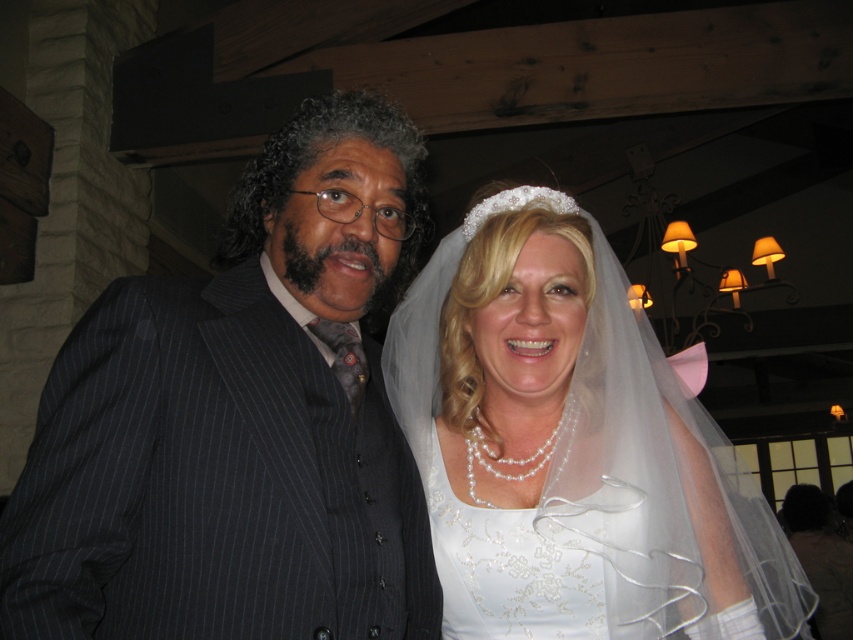
Question: Can you confirm if dark pinstripe suit at left is positioned above white satin dress at center?

Choices:
 (A) yes
 (B) no

Answer: (A)

Question: Which point appears farthest from the camera in this image?

Choices:
 (A) (733, 563)
 (B) (254, 547)

Answer: (A)

Question: Does dark pinstripe suit at left lie in front of white satin dress at center?

Choices:
 (A) no
 (B) yes

Answer: (B)

Question: Is dark pinstripe suit at left positioned before white satin dress at center?

Choices:
 (A) no
 (B) yes

Answer: (B)